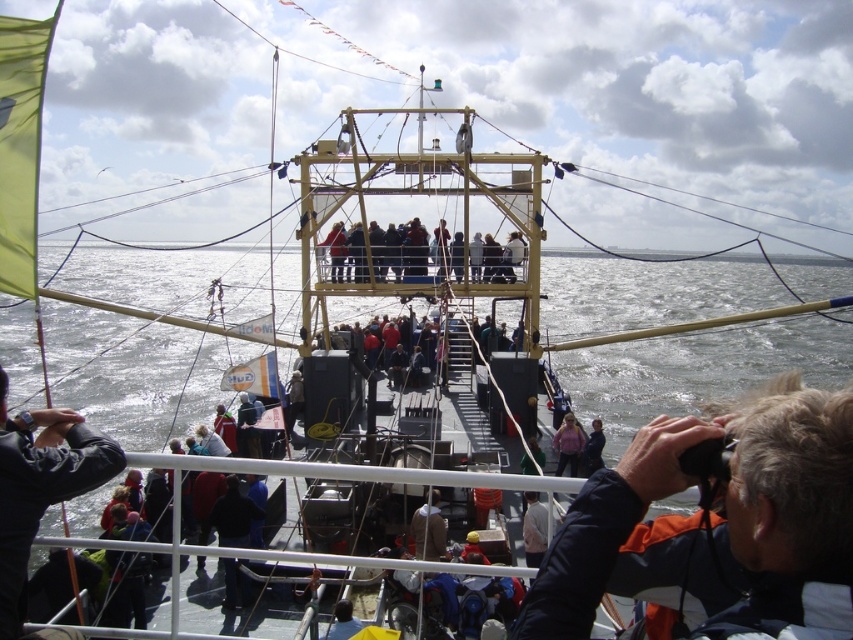
Consider the image. You are standing on the deck of the vessel and want to take a photo of the dark blue jacket at lower right using the black fabric camera at lower left. Is the camera positioned in a way that you can easily capture the jacket without moving either the jacket or the camera?

The dark blue jacket at lower right is closer to the viewer than the black fabric camera at lower left. Therefore, to take a photo of the jacket using the camera, you would need to adjust the camera angle or move closer, as the jacket is nearer to you than the camera.

You are on a tour of the ship and need to locate the dark blue jacket at lower right and the light brown wooden deck at center. Which object is closer to the ship railing?

The dark blue jacket at lower right is closer to the ship railing because it is positioned at the lower right, which is typically near the edge of the ship, whereas the light brown wooden deck at center is situated in the middle of the ship, farther from the railing.